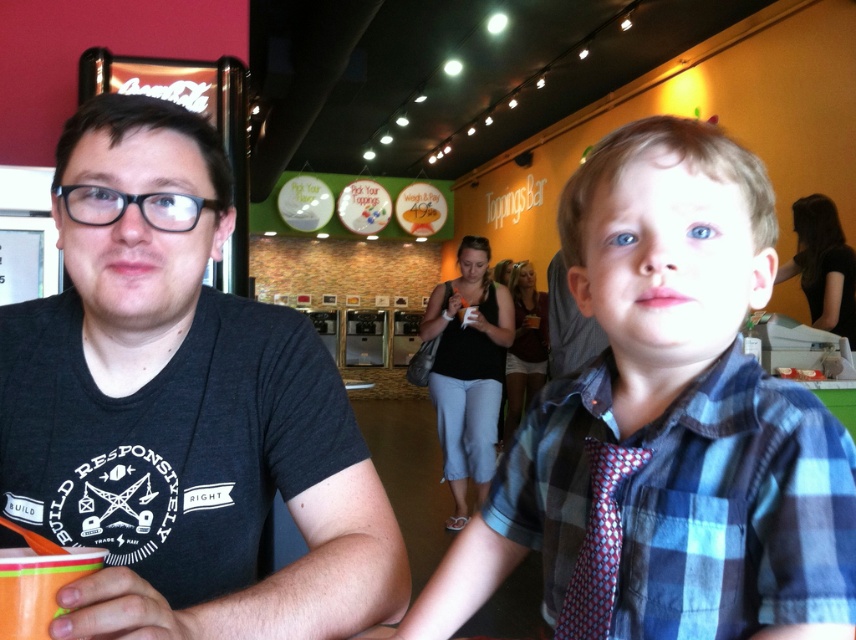
Consider the image. You are standing in the food court and see the blue plaid shirt at center and the matte maroon shirt at center. Which one is closer to you?

The blue plaid shirt at center is closer to you because it is in front of the matte maroon shirt at center.

Consider the image. You are standing at the point labeled as point [597,148] and want to walk to the point labeled as point [116,400]. According to the spatial arrangement in the image, which direction should you move relative to your current position?

To reach point [116,400] from point [597,148], you should move downward and to the right since point [116,400] is positioned behind point [597,148] in the image.